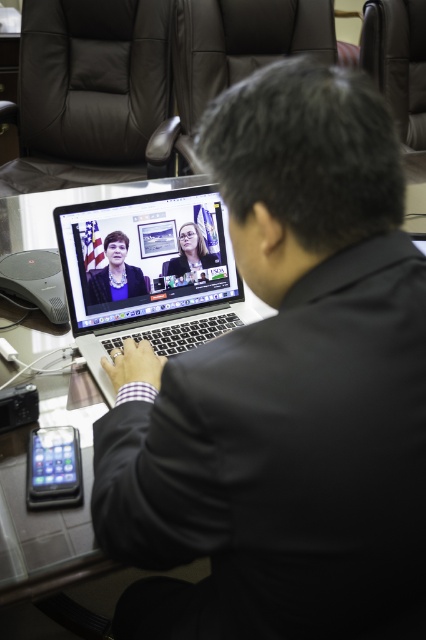
Question: Does sleek silver laptop at center have a lesser width compared to matte black woman at center?

Choices:
 (A) no
 (B) yes

Answer: (A)

Question: Can you confirm if sleek silver laptop at center is bigger than matte black woman at center?

Choices:
 (A) no
 (B) yes

Answer: (B)

Question: Which object appears farthest from the camera in this image?

Choices:
 (A) matte black suit at center
 (B) matte black woman at center
 (C) black matte laptop at center
 (D) sleek silver laptop at center

Answer: (A)

Question: Does black matte laptop at center have a larger size compared to matte black woman at center?

Choices:
 (A) yes
 (B) no

Answer: (A)

Question: Which point is farther from the camera taking this photo?

Choices:
 (A) (239, 259)
 (B) (126, 289)
 (C) (189, 250)
 (D) (219, 262)

Answer: (D)

Question: Which object is positioned closest to the matte black suit at center?

Choices:
 (A) sleek silver laptop at center
 (B) matte black woman at center

Answer: (A)